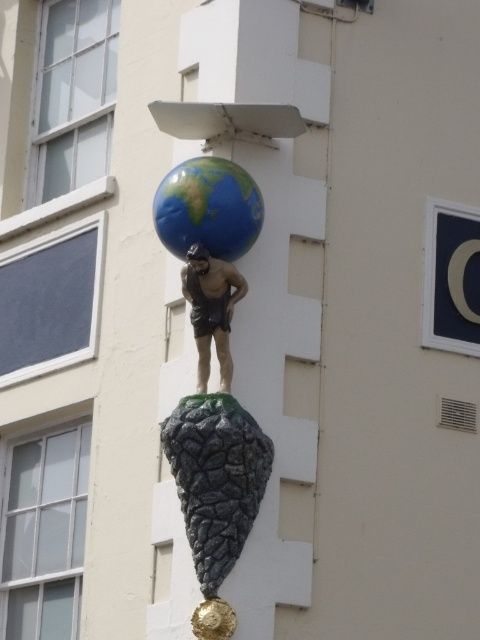
The width and height of the screenshot is (480, 640). What do you see at coordinates (208, 362) in the screenshot? I see `polished stone globe at center` at bounding box center [208, 362].

Can you confirm if polished stone globe at center is positioned below matte bronze statue at center?

Correct, polished stone globe at center is located below matte bronze statue at center.

Who is more distant from viewer, (224, 218) or (219, 260)?

Positioned behind is point (219, 260).

I want to click on polished stone globe at center, so click(x=208, y=362).